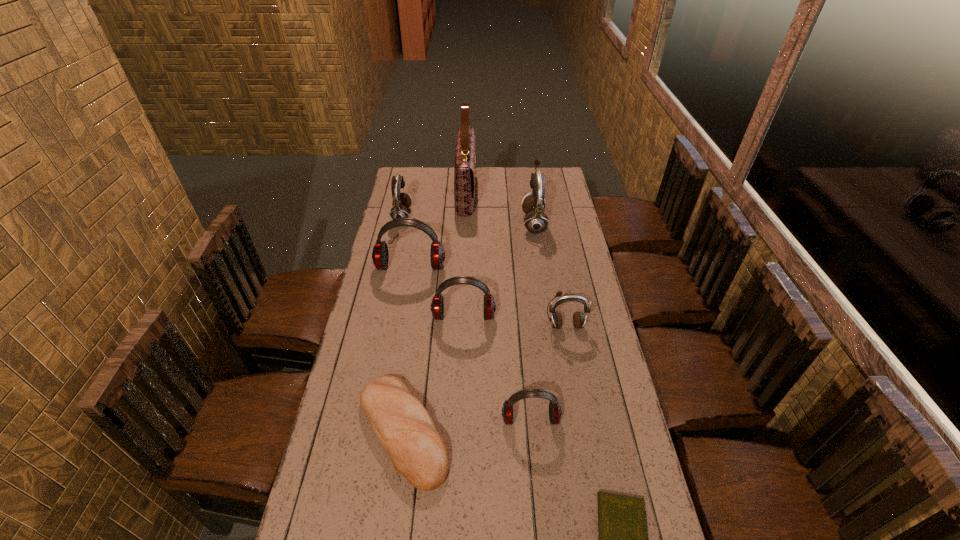
The image size is (960, 540). Find the location of `free location located 0.200m on the ear pads of the nearest brown earphone`. free location located 0.200m on the ear pads of the nearest brown earphone is located at coordinates (575, 380).

Identify the location of vacant space located on the ear cups of the smallest red earphone. Image resolution: width=960 pixels, height=540 pixels. (533, 446).

Find the location of a particular element. The width and height of the screenshot is (960, 540). vacant space positioned on the front of the brown bread is located at coordinates (389, 534).

Locate an element on the screen. This screenshot has width=960, height=540. object present at the far edge is located at coordinates (464, 169).

The height and width of the screenshot is (540, 960). I want to click on bread located in the left edge section of the desktop, so click(x=403, y=426).

This screenshot has height=540, width=960. I want to click on blank space at the far edge of the desktop, so click(499, 168).

What are the coordinates of `free space at the left edge of the desktop` in the screenshot? It's located at (x=367, y=431).

At what (x,y) coordinates should I click in order to perform the action: click on free space at the right edge of the desktop. Please return your answer as a coordinate pair (x, y). The height and width of the screenshot is (540, 960). Looking at the image, I should click on (574, 230).

Where is `vacant space at the far right corner of the desktop`? The height and width of the screenshot is (540, 960). vacant space at the far right corner of the desktop is located at coordinates pos(554,169).

The height and width of the screenshot is (540, 960). I want to click on unoccupied area between the bread and the second smallest red earphone, so click(433, 374).